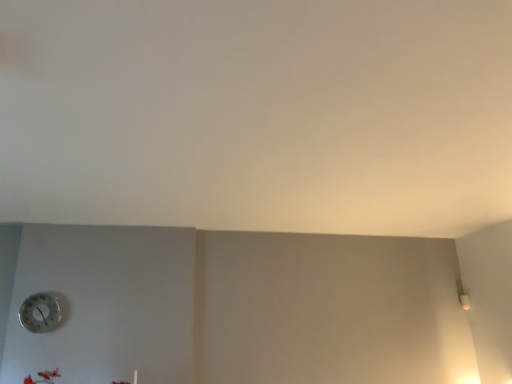
Describe the element at coordinates (40, 313) in the screenshot. I see `metallic silver clock at lower left` at that location.

At what (x,y) coordinates should I click in order to perform the action: click on metallic silver clock at lower left. Please return your answer as a coordinate pair (x, y). Looking at the image, I should click on (40, 313).

Where is `metallic silver clock at lower left`? This screenshot has height=384, width=512. metallic silver clock at lower left is located at coordinates (40, 313).